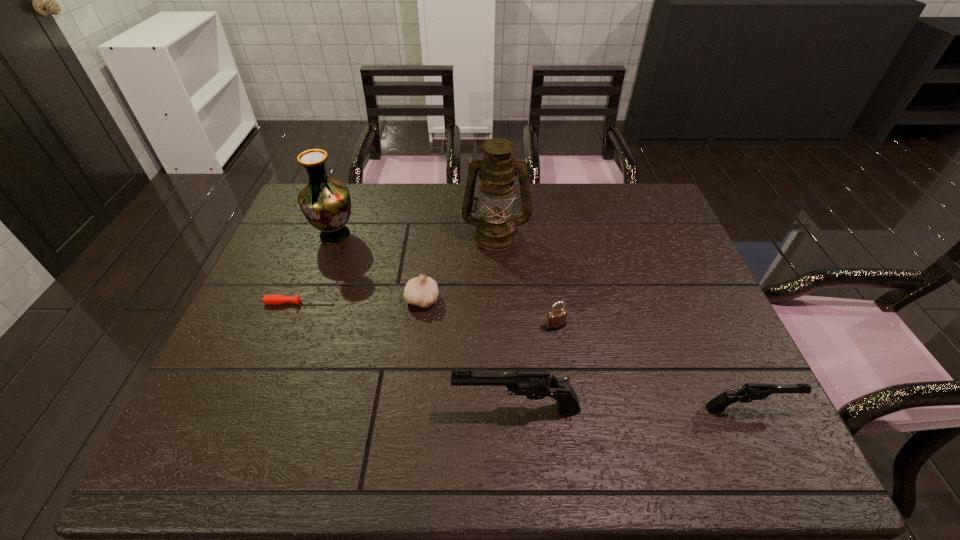
This screenshot has height=540, width=960. I want to click on the left gun, so click(x=534, y=384).

The height and width of the screenshot is (540, 960). In order to click on the fifth shortest object in this screenshot , I will do `click(534, 384)`.

You are a GUI agent. You are given a task and a screenshot of the screen. Output one action in this format:
    pyautogui.click(x=<x>, y=<y>)
    Task: Click on the rightmost object
    The image size is (960, 540).
    Given the screenshot: What is the action you would take?
    pyautogui.click(x=749, y=392)

In order to click on the shorter gun in this screenshot , I will do `click(749, 392)`.

The image size is (960, 540). What are the coordinates of `garlic` in the screenshot? It's located at (422, 291).

Find the location of a particular element. oil lamp is located at coordinates (x=496, y=230).

This screenshot has width=960, height=540. Identify the location of vase. (325, 202).

This screenshot has width=960, height=540. I want to click on padlock, so click(556, 319).

What are the coordinates of `the shortest object` in the screenshot? It's located at (267, 299).

Where is `vacant area situated 0.260m at the end of the barrel of the third tallest object`? The width and height of the screenshot is (960, 540). vacant area situated 0.260m at the end of the barrel of the third tallest object is located at coordinates (333, 408).